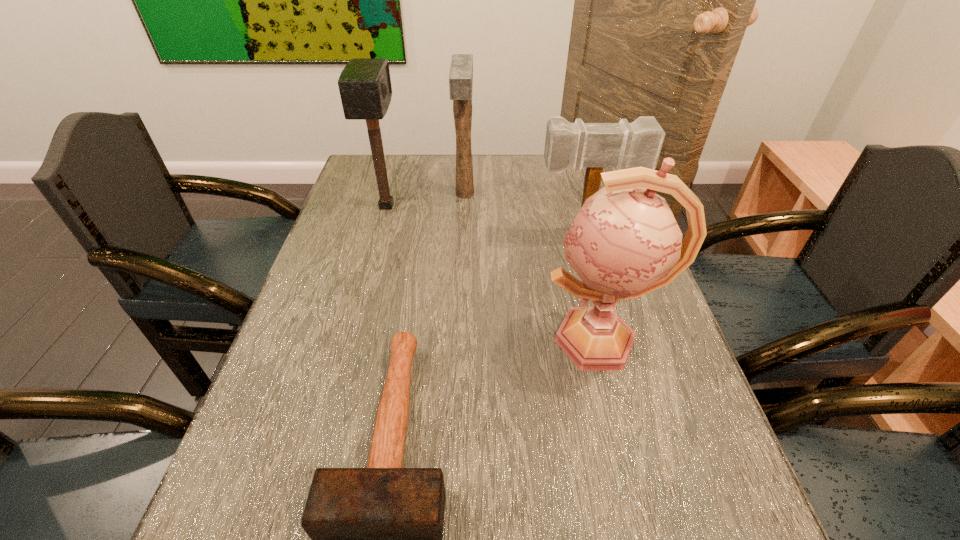
Locate an element on the screen. globe is located at coordinates point(624,243).

In order to click on the rightmost mallet in this screenshot , I will do (638, 144).

I want to click on the third nearest object, so click(x=638, y=144).

The image size is (960, 540). I want to click on free space located 0.240m on the front-facing side of the globe, so click(x=431, y=340).

Locate an element on the screen. free space located on the front-facing side of the globe is located at coordinates (500, 340).

Identify the location of free region located 0.130m on the front-facing side of the globe. The width and height of the screenshot is (960, 540). (482, 340).

Where is `vacant space located 0.050m on the front of the third farthest object`? vacant space located 0.050m on the front of the third farthest object is located at coordinates (588, 263).

Where is `object that is at the left edge`? The image size is (960, 540). object that is at the left edge is located at coordinates (364, 84).

Find the location of a particular element. The image size is (960, 540). globe that is at the right edge is located at coordinates (624, 243).

Identify the location of mallet at the right edge. (638, 144).